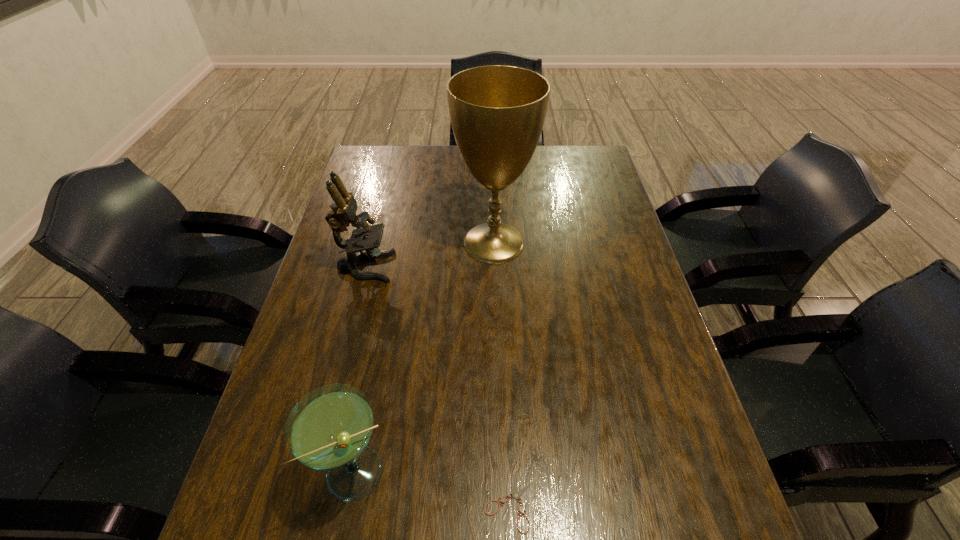
The image size is (960, 540). Identify the location of vacant space at the far edge of the desktop. (453, 173).

The height and width of the screenshot is (540, 960). Find the location of `vacant space at the left edge of the desktop`. vacant space at the left edge of the desktop is located at coordinates (391, 203).

Where is `vacant area at the right edge`? vacant area at the right edge is located at coordinates (655, 321).

Image resolution: width=960 pixels, height=540 pixels. I want to click on vacant area between the shortest object and the second tallest object, so click(437, 385).

Locate an element on the screen. Image resolution: width=960 pixels, height=540 pixels. empty location between the microscope and the martini is located at coordinates (361, 369).

The height and width of the screenshot is (540, 960). In order to click on free space between the microscope and the shears in this screenshot , I will do `click(437, 385)`.

Where is `unoccupied area between the martini and the trophy cup`? The image size is (960, 540). unoccupied area between the martini and the trophy cup is located at coordinates (425, 357).

You are a GUI agent. You are given a task and a screenshot of the screen. Output one action in this format:
    pyautogui.click(x=<x>, y=<y>)
    Task: Click on the free area in between the shears and the microscope
    This screenshot has width=960, height=540.
    Given the screenshot: What is the action you would take?
    pyautogui.click(x=437, y=385)

Where is `free space between the microscope and the trophy cup`? The height and width of the screenshot is (540, 960). free space between the microscope and the trophy cup is located at coordinates (430, 254).

You are a GUI agent. You are given a task and a screenshot of the screen. Output one action in this format:
    pyautogui.click(x=<x>, y=<y>)
    Task: Click on the empty location between the second shortest object and the second tallest object
    The height and width of the screenshot is (540, 960).
    Given the screenshot: What is the action you would take?
    pyautogui.click(x=361, y=369)